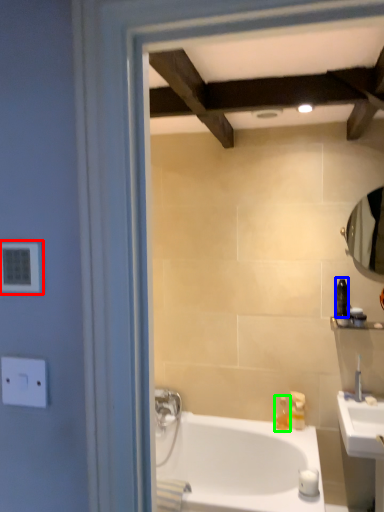
Question: Which object is positioned farthest from electric outlet (highlighted by a red box)? Select from toiletry (highlighted by a blue box) and soap dispenser (highlighted by a green box).

Choices:
 (A) toiletry
 (B) soap dispenser

Answer: (B)